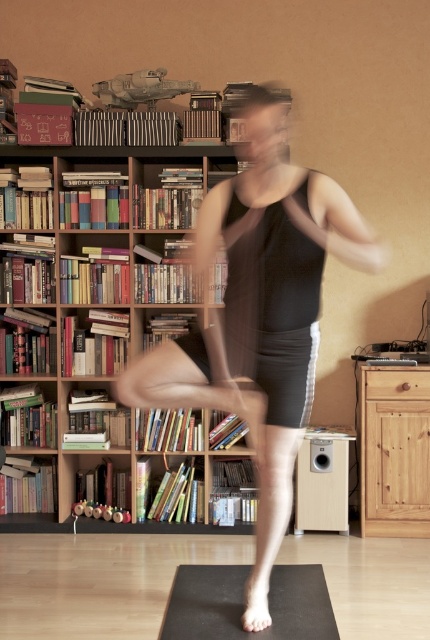
Identify the location of wooden bookcase at left. Image resolution: width=430 pixels, height=640 pixels. [100, 346].

Which of these two, wooden bookcase at left or black rubber yoga mat at lower center, stands taller?

With more height is wooden bookcase at left.

Which is in front, point (123, 333) or point (322, 570)?

Positioned in front is point (322, 570).

Locate an element on the screen. wooden bookcase at left is located at coordinates (100, 346).

Is wooden bookcase at left to the left of black matte tank top at center from the viewer's perspective?

Correct, you'll find wooden bookcase at left to the left of black matte tank top at center.

Measure the distance between wooden bookcase at left and black matte tank top at center.

1.65 meters

Does point (33, 378) come behind point (258, 284)?

That is True.

This screenshot has width=430, height=640. Find the location of `wooden bookcase at left`. wooden bookcase at left is located at coordinates (100, 346).

This screenshot has height=640, width=430. I want to click on black matte tank top at center, so click(261, 316).

Does black matte tank top at center have a greater width compared to black rubber yoga mat at lower center?

Indeed, black matte tank top at center has a greater width compared to black rubber yoga mat at lower center.

Does point (275, 522) come behind point (186, 564)?

That is False.

This screenshot has height=640, width=430. What are the coordinates of `black matte tank top at center` in the screenshot? It's located at (261, 316).